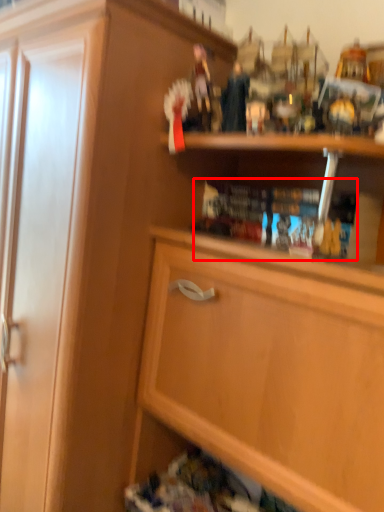
Question: From the image's perspective, considering the relative positions of book (annotated by the red box) and cabinetry in the image provided, where is book (annotated by the red box) located with respect to the staircase?

Choices:
 (A) below
 (B) above

Answer: (B)